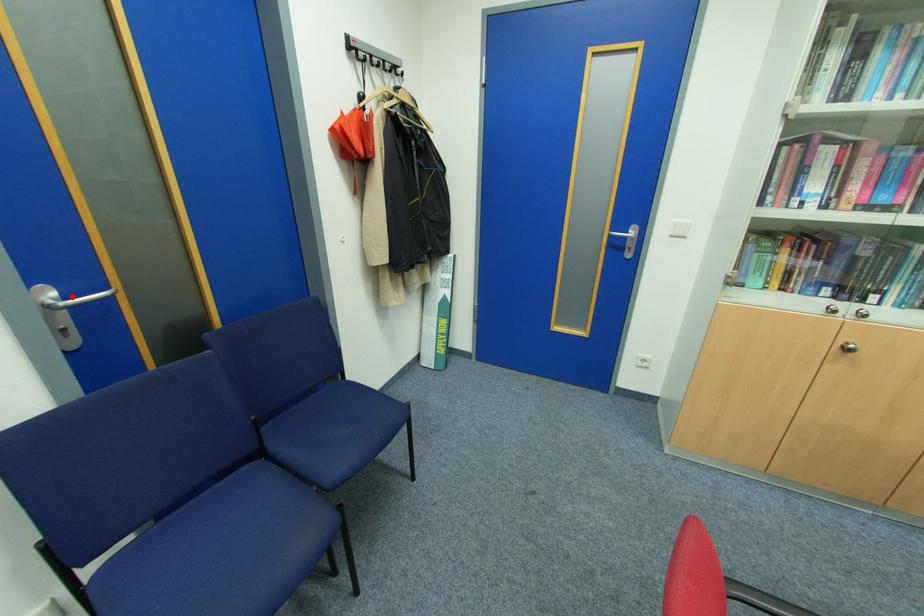
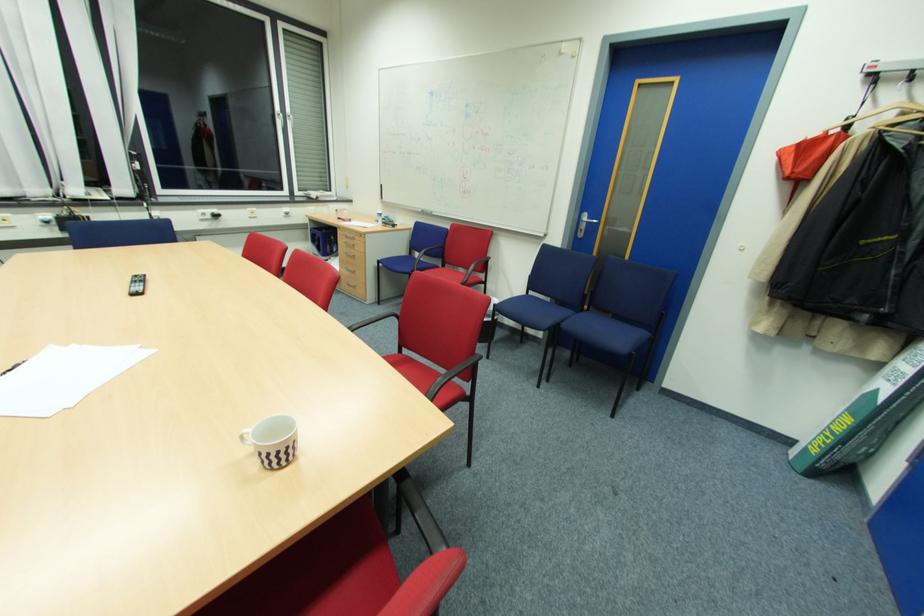
Where in the second image is the point corresponding to the highlighted location from the first image?

(591, 220)